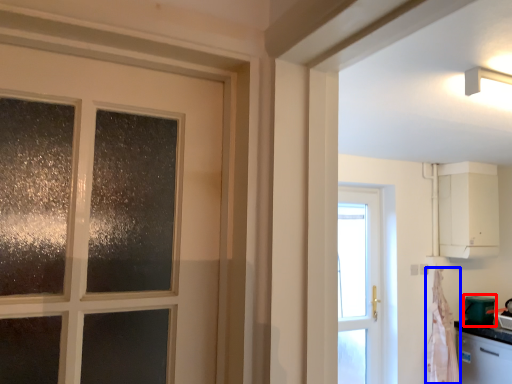
Question: Which of the following is the farthest to the observer, appliance (highlighted by a red box) or curtain (highlighted by a blue box)?

Choices:
 (A) appliance
 (B) curtain

Answer: (A)